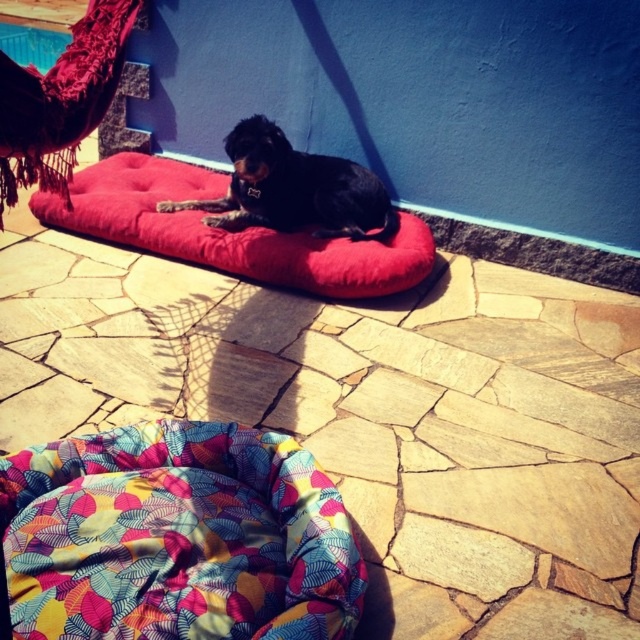
Question: Which of the following is the farthest from the observer?

Choices:
 (A) velvet red dog bed at center
 (B) multicolored fabric bean bag at center

Answer: (A)

Question: Does multicolored fabric bean bag at center have a lesser width compared to black smooth dog at center?

Choices:
 (A) yes
 (B) no

Answer: (A)

Question: Is multicolored fabric bean bag at center below black smooth dog at center?

Choices:
 (A) no
 (B) yes

Answer: (B)

Question: Which point is closer to the camera taking this photo?

Choices:
 (A) (316, 221)
 (B) (141, 195)

Answer: (B)

Question: Is multicolored fabric bean bag at center smaller than velvet red dog bed at center?

Choices:
 (A) no
 (B) yes

Answer: (B)

Question: Which point is farther from the camera taking this photo?

Choices:
 (A) pyautogui.click(x=296, y=227)
 (B) pyautogui.click(x=392, y=244)
 (C) pyautogui.click(x=58, y=468)

Answer: (A)